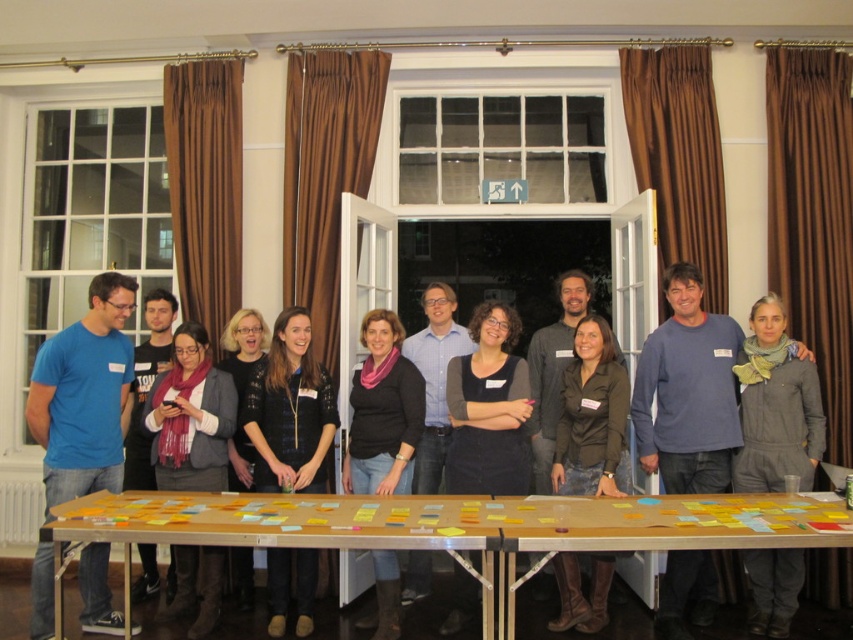
Question: From the image, what is the correct spatial relationship of blue t-shirt at left in relation to gray woolen jacket at lower right?

Choices:
 (A) left
 (B) right

Answer: (A)

Question: Is the position of wooden table at center more distant than that of gray woolen jacket at lower right?

Choices:
 (A) no
 (B) yes

Answer: (A)

Question: Does wooden table at center appear over blue t-shirt at left?

Choices:
 (A) yes
 (B) no

Answer: (B)

Question: Among these points, which one is nearest to the camera?

Choices:
 (A) (56, 500)
 (B) (810, 376)
 (C) (488, 557)

Answer: (C)

Question: Which point is closer to the camera?

Choices:
 (A) (48, 534)
 (B) (88, 548)

Answer: (A)

Question: Based on their relative distances, which object is nearer to the blue cotton shirt at center?

Choices:
 (A) wooden table at center
 (B) blue t-shirt at left

Answer: (A)